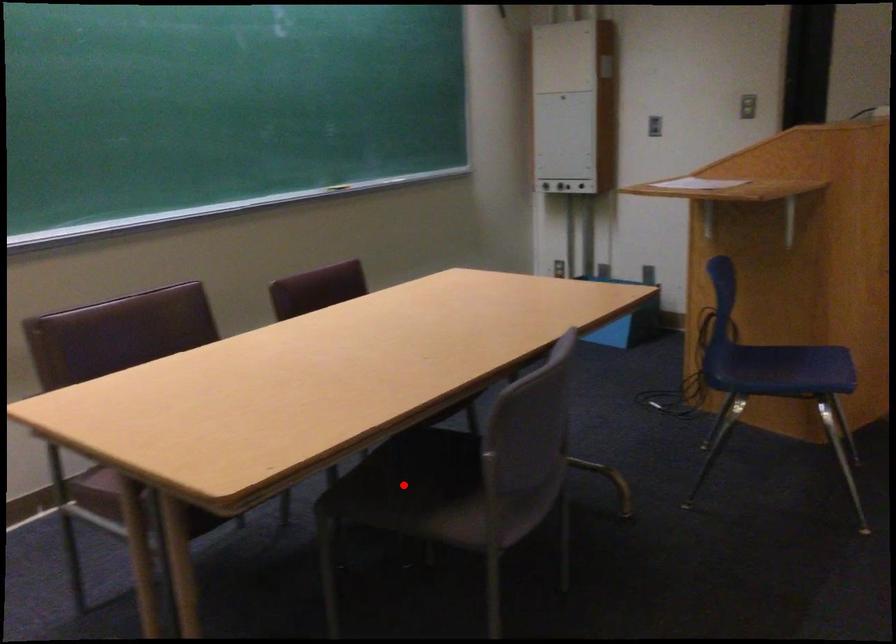
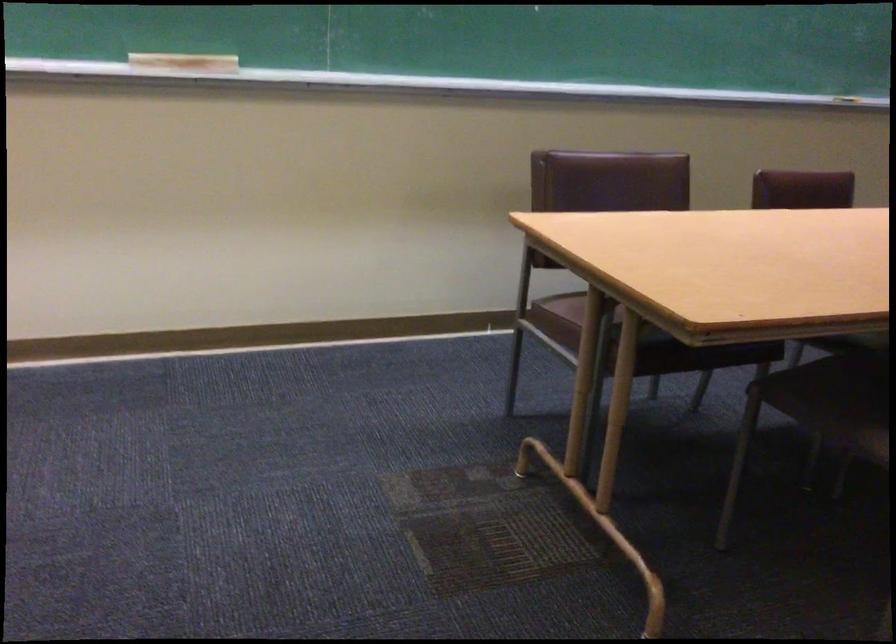
Find the pixel in the second image that matches the highlighted location in the first image.

(833, 391)